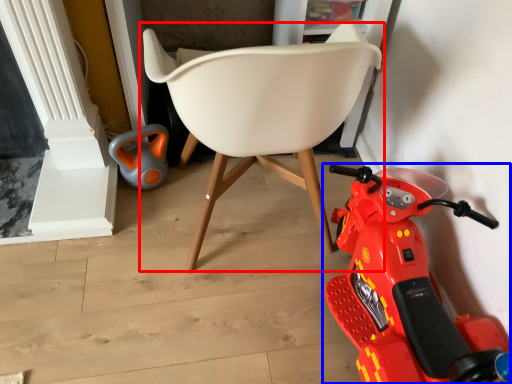
Question: Among these objects, which one is nearest to the camera, chair (highlighted by a red box) or land vehicle (highlighted by a blue box)?

Choices:
 (A) chair
 (B) land vehicle

Answer: (A)